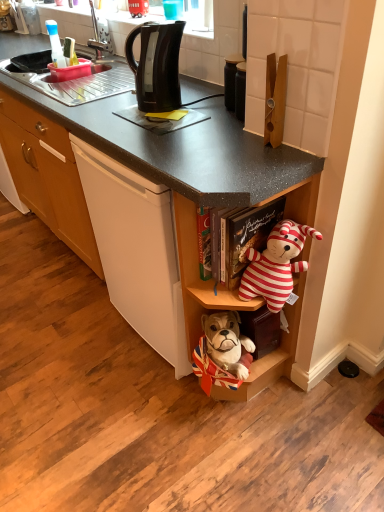
Image resolution: width=384 pixels, height=512 pixels. In order to click on vacant space to the right of wooden shelf at lower center in this screenshot , I will do [x=324, y=401].